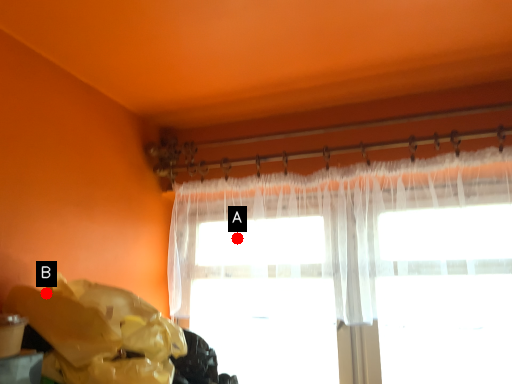
Question: Two points are circled on the image, labeled by A and B beside each circle. Which of the following is the farthest from the observer?

Choices:
 (A) A is further
 (B) B is further

Answer: (A)